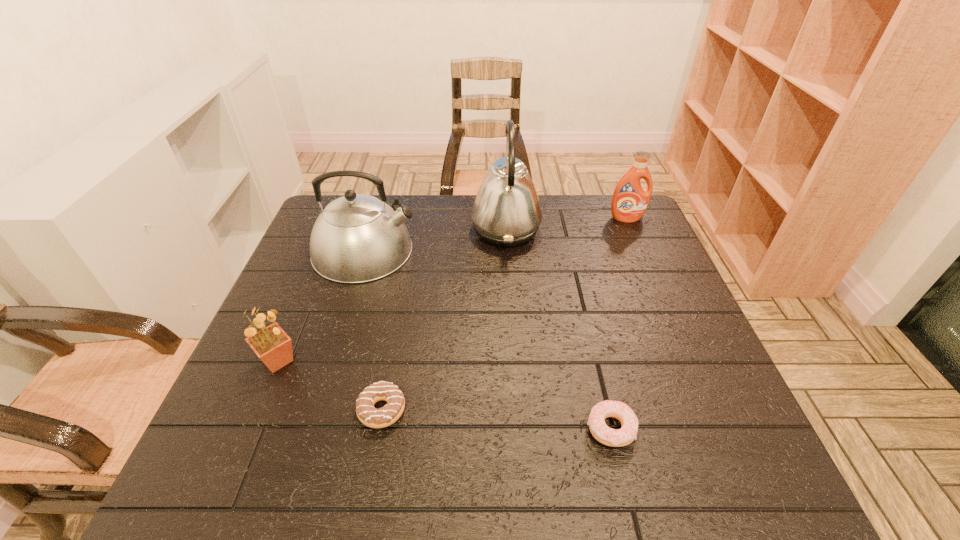
Identify which object is the closest to the rightmost object. Please provide its 2D coordinates. Your answer should be formatted as a tuple, i.e. [(x, y)], where the tuple contains the x and y coordinates of a point satisfying the conditions above.

[(506, 212)]

Image resolution: width=960 pixels, height=540 pixels. I want to click on vacant space that satisfies the following two spatial constraints: 1. from the spout of the shorter kettle; 2. on the right side of the right doughnut, so click(x=309, y=428).

Locate an element on the screen. free space in the image that satisfies the following two spatial constraints: 1. from the spout of the left doughnut; 2. on the right side of the shorter kettle is located at coordinates (315, 410).

Identify the location of vacant space that satisfies the following two spatial constraints: 1. at the front of the fourth farthest object with flowers visible; 2. on the left side of the left doughnut. [x=257, y=410].

The height and width of the screenshot is (540, 960). In order to click on free point that satisfies the following two spatial constraints: 1. at the front of the left doughnut with flowers visible; 2. on the left side of the sunflower in this screenshot , I will do `click(257, 410)`.

Identify the location of free space in the image that satisfies the following two spatial constraints: 1. on the front-facing side of the detergent; 2. at the front of the fourth farthest object with flowers visible. (687, 361).

This screenshot has width=960, height=540. Identify the location of vacant region that satisfies the following two spatial constraints: 1. from the spout of the right doughnut; 2. on the left side of the fourth object from left to right. (520, 428).

The height and width of the screenshot is (540, 960). In order to click on vacant space that satisfies the following two spatial constraints: 1. on the front-facing side of the third tallest object; 2. at the front of the fourth farthest object with flowers visible in this screenshot , I will do `click(687, 361)`.

This screenshot has width=960, height=540. I want to click on free space that satisfies the following two spatial constraints: 1. from the spout of the shorter kettle; 2. on the left side of the right doughnut, so click(x=309, y=428).

The width and height of the screenshot is (960, 540). What are the coordinates of `vacant space that satisfies the following two spatial constraints: 1. at the front of the fourth tallest object with flowers visible; 2. on the left side of the right doughnut` in the screenshot? It's located at pyautogui.click(x=250, y=428).